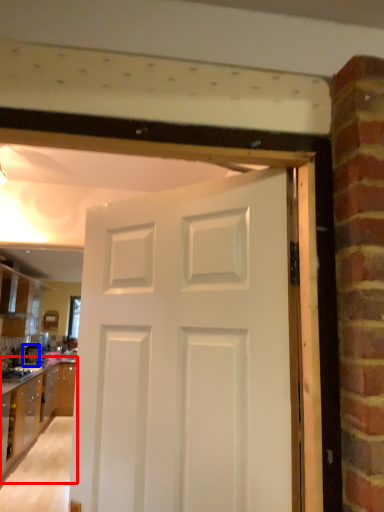
Question: Which object appears farthest to the camera in this image, cabinetry (highlighted by a red box) or appliance (highlighted by a blue box)?

Choices:
 (A) cabinetry
 (B) appliance

Answer: (B)